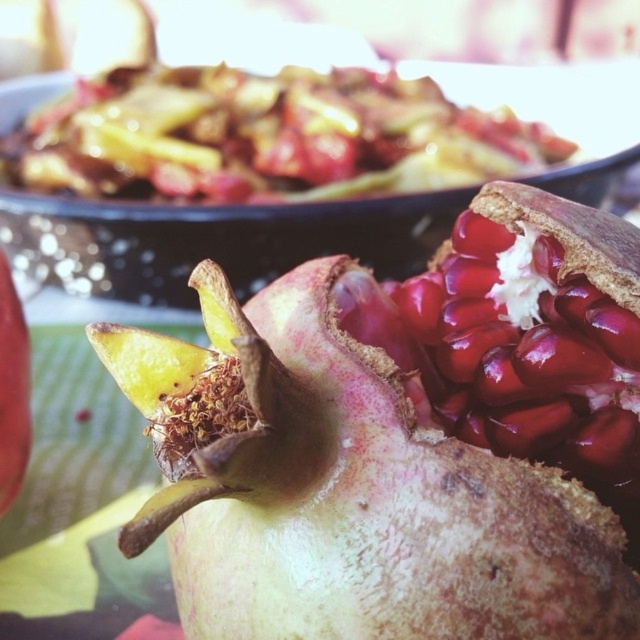
You are a chef preparing a garnish for the dish in the background. You need to place a decorative item exactly at the point marked by coordinates (368, 502) on the pomegranate. Where on the pomegranate should you place it?

The point at coordinates (368, 502) is located on the greenish brown textured pomegranate at center, so you should place the decorative item on the greenish brown textured area of the pomegranate at its center.

You are holding a knife and want to cut the pomegranate at point (384,598). Can you reach that point with your knife if you are standing 20 inches away from the pomegranate?

The distance between point (384,598) and the viewer is 22.27 inches. Since you are standing 20 inches away from the pomegranate, you are closer than the required distance, so you can reach the point with your knife.